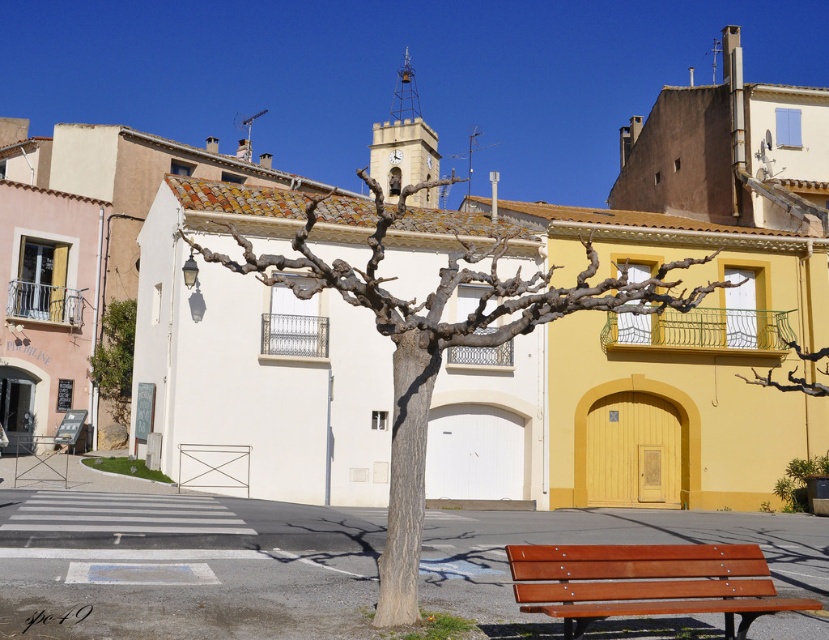
Between point (386, 570) and point (762, 579), which one is positioned behind?

Point (386, 570)

Can you confirm if bare wood tree at center is wider than brown wooden bench at lower right?

Yes, bare wood tree at center is wider than brown wooden bench at lower right.

Who is more distant from viewer, (461, 268) or (714, 608)?

The point (461, 268) is behind.

I want to click on bare wood tree at center, so click(437, 342).

Can you confirm if bare wood tree at center is wider than green leafy tree at left?

Yes, bare wood tree at center is wider than green leafy tree at left.

Which is below, bare wood tree at center or green leafy tree at left?

green leafy tree at left is lower down.

Find the location of a particular element. bare wood tree at center is located at coordinates (437, 342).

Where is `bare wood tree at center`? This screenshot has width=829, height=640. bare wood tree at center is located at coordinates (437, 342).

Is brown wooden bench at lower right wider than green leafy tree at left?

Correct, the width of brown wooden bench at lower right exceeds that of green leafy tree at left.

Can you confirm if brown wooden bench at lower right is thinner than green leafy tree at left?

In fact, brown wooden bench at lower right might be wider than green leafy tree at left.

Is point (565, 548) closer to viewer compared to point (124, 368)?

That is True.

This screenshot has width=829, height=640. What are the coordinates of `brown wooden bench at lower right` in the screenshot? It's located at (645, 582).